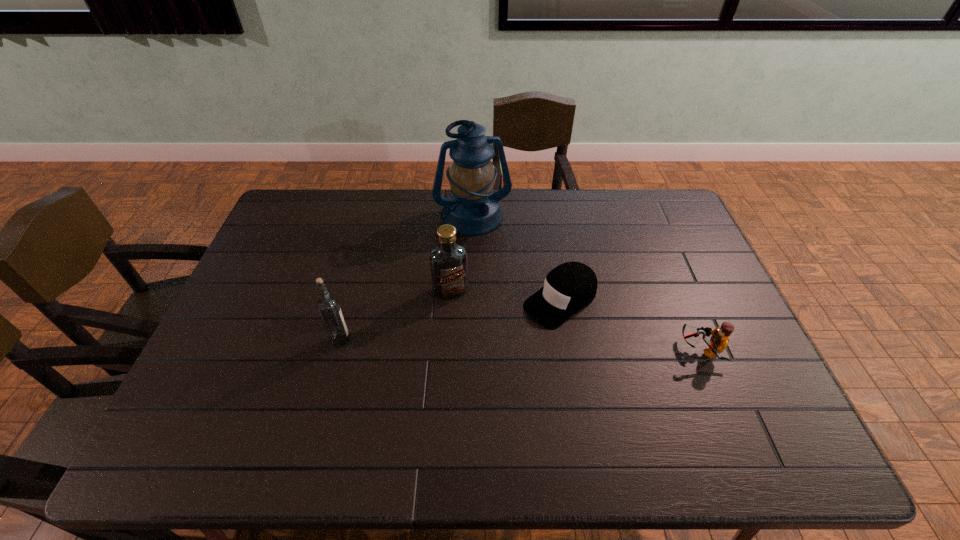
I want to click on vacant spot on the desktop that is between the nearer vodka and the second shortest object and is positioned on the face of the farthest object, so click(x=515, y=345).

Where is `free spot on the desktop that is between the leftmost object and the Lego and is positioned on the front-facing side of the shortest object`? The width and height of the screenshot is (960, 540). free spot on the desktop that is between the leftmost object and the Lego and is positioned on the front-facing side of the shortest object is located at coordinates (498, 345).

Image resolution: width=960 pixels, height=540 pixels. I want to click on free spot on the desktop that is between the left vodka and the fourth tallest object and is positioned on the front-facing side of the right vodka, so click(x=471, y=343).